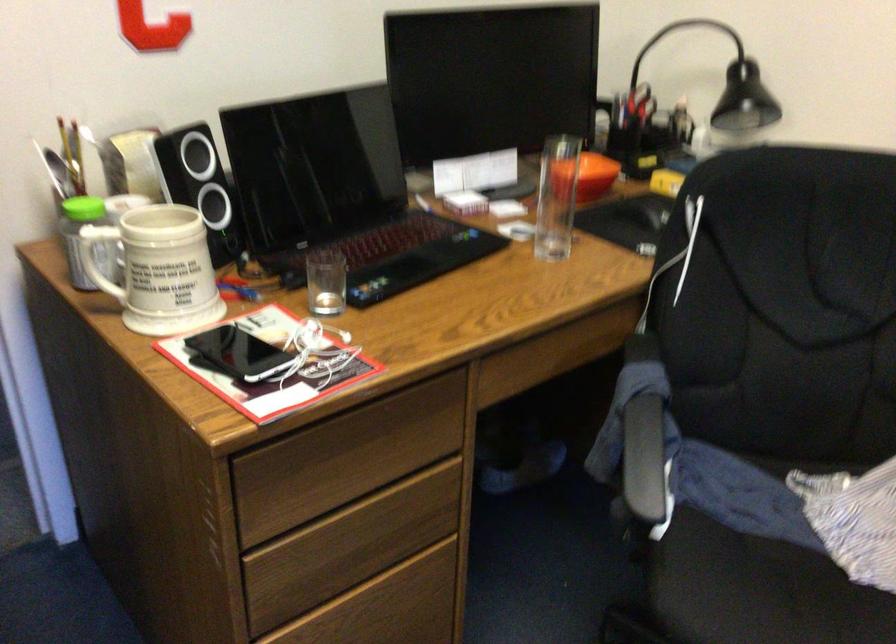
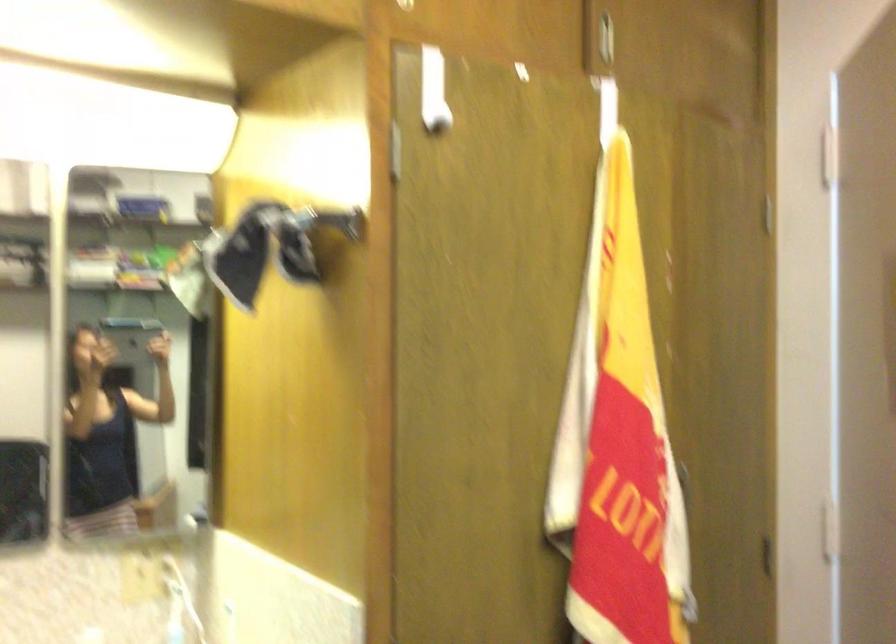
Question: How did the camera likely rotate?

Choices:
 (A) Left
 (B) Right
 (C) Up
 (D) Down

Answer: (A)